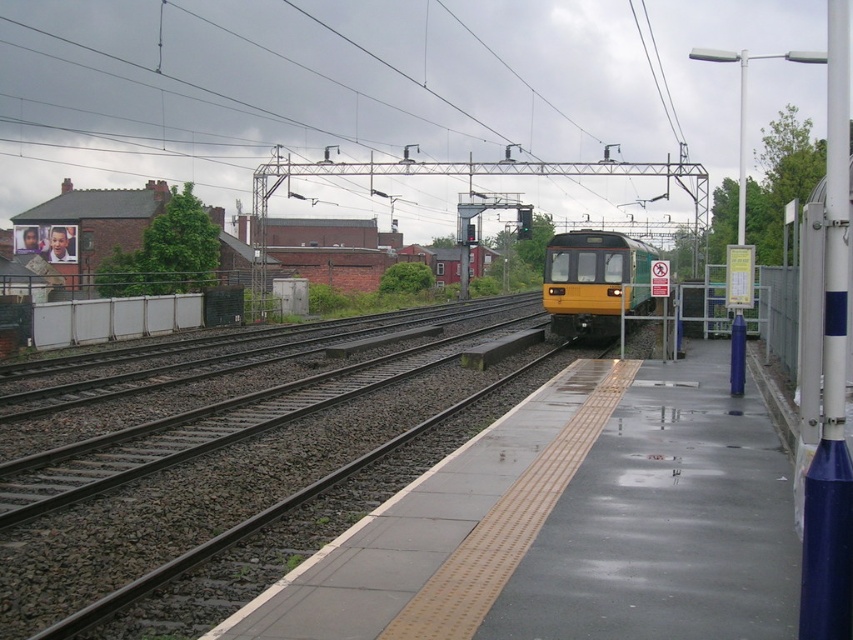
You are standing on the platform and want to take a photo of the approaching train. The camera you have can only focus on objects within 15 feet. Is the smooth concrete platform at center within the camera focus range?

The smooth concrete platform at center is 14.03 feet away from the camera, which is within the 15 feet focus range. Therefore, the camera can focus on the smooth concrete platform at center.

You are a passenger waiting on the smooth concrete platform at center. You notice the yellow matte train at center approaching. Based on their sizes, which object is closer to you?

The yellow matte train at center is closer because objects appear smaller when they are farther away, but in this case, the smooth concrete platform at center is smaller in size compared to the yellow matte train at center, which suggests the train is closer.

You are standing at the railway station platform. The train is approaching from the distance. You need to locate the exact spot where the smooth concrete platform at center is positioned. According to the coordinates provided, where would you find it?

The smooth concrete platform at center is positioned at coordinates point (570, 525).